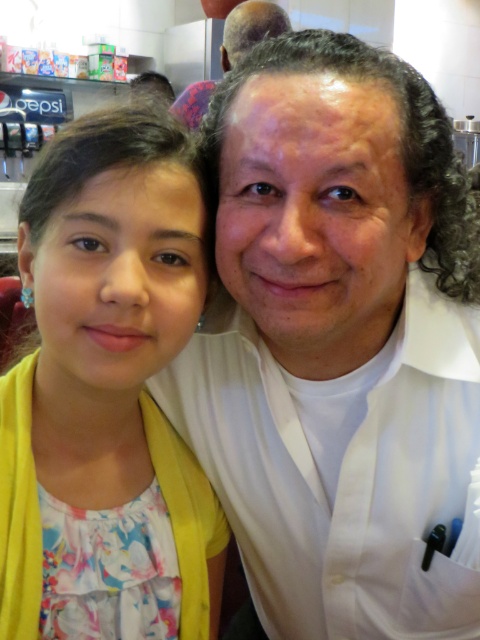
Is point (66, 524) closer to camera compared to point (257, 8)?

Yes, point (66, 524) is closer to viewer.

Is floral fabric dress at left further to camera compared to matte black hair at upper center?

No.

This screenshot has height=640, width=480. Describe the element at coordinates (107, 394) in the screenshot. I see `floral fabric dress at left` at that location.

The width and height of the screenshot is (480, 640). In order to click on floral fabric dress at left in this screenshot , I will do `click(107, 394)`.

Who is more forward, (432, 172) or (98, 259)?

Point (98, 259) is in front.

Between white smooth shirt at center and floral fabric dress at left, which one appears on the left side from the viewer's perspective?

floral fabric dress at left is more to the left.

Where is `white smooth shirt at center`? The height and width of the screenshot is (640, 480). white smooth shirt at center is located at coordinates tap(337, 339).

Can you confirm if white smooth shirt at center is smaller than matte black hair at upper center?

Indeed, white smooth shirt at center has a smaller size compared to matte black hair at upper center.

Is point (330, 161) closer to camera compared to point (252, 20)?

Yes, it is.

Which is behind, point (432, 460) or point (187, 116)?

Positioned behind is point (187, 116).

Find the location of a particular element. The width and height of the screenshot is (480, 640). white smooth shirt at center is located at coordinates (337, 339).